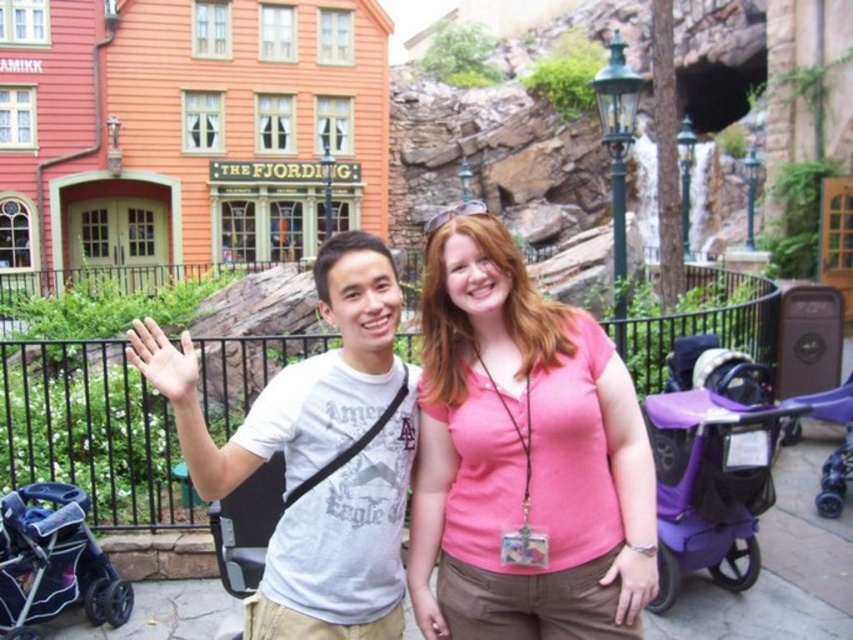
Question: Where is white cotton t-shirt at center located in relation to purple matte baby carriage at lower right in the image?

Choices:
 (A) above
 (B) below

Answer: (A)

Question: Can you confirm if white cotton t-shirt at center is thinner than dark purple plastic stroller at lower left?

Choices:
 (A) yes
 (B) no

Answer: (B)

Question: Which object is positioned farthest from the pink matte shirt at center?

Choices:
 (A) dark purple plastic stroller at lower left
 (B) purple matte baby carriage at lower right

Answer: (A)

Question: Among these objects, which one is farthest from the camera?

Choices:
 (A) purple matte baby carriage at lower right
 (B) dark purple plastic stroller at lower left
 (C) pink matte shirt at center

Answer: (A)

Question: Which of the following is the farthest from the observer?

Choices:
 (A) white cotton t-shirt at center
 (B) pink matte shirt at center
 (C) dark purple plastic stroller at lower left
 (D) purple matte baby carriage at lower right

Answer: (D)

Question: Is pink matte shirt at center to the left of dark purple plastic stroller at lower left from the viewer's perspective?

Choices:
 (A) yes
 (B) no

Answer: (B)